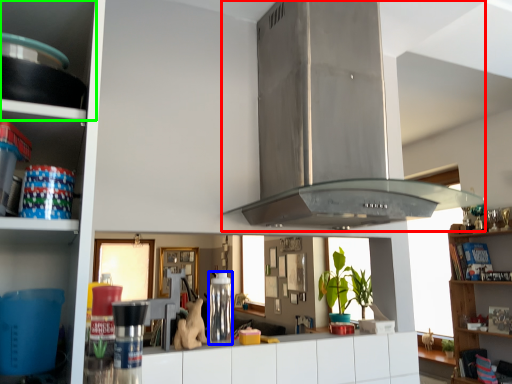
Question: Which object is positioned closest to exhaust hood (highlighted by a red box)? Select from appliance (highlighted by a blue box) and shelf (highlighted by a green box).

Choices:
 (A) appliance
 (B) shelf

Answer: (A)